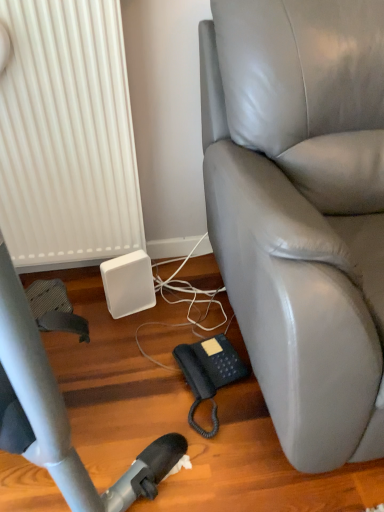
Question: Does black rubberized phone at lower center come in front of gray leather chair at right?

Choices:
 (A) yes
 (B) no

Answer: (B)

Question: From the image's perspective, is black rubberized phone at lower center beneath gray leather chair at right?

Choices:
 (A) yes
 (B) no

Answer: (A)

Question: From a real-world perspective, is black rubberized phone at lower center positioned under gray leather chair at right based on gravity?

Choices:
 (A) no
 (B) yes

Answer: (B)

Question: Can gray leather chair at right be found inside black rubberized phone at lower center?

Choices:
 (A) yes
 (B) no

Answer: (B)

Question: From a real-world perspective, is black rubberized phone at lower center on gray leather chair at right?

Choices:
 (A) yes
 (B) no

Answer: (B)

Question: Can you confirm if black rubberized phone at lower center is shorter than gray leather chair at right?

Choices:
 (A) yes
 (B) no

Answer: (A)

Question: Is white ribbed radiator at lower left turned away from gray leather chair at right?

Choices:
 (A) yes
 (B) no

Answer: (B)

Question: From a real-world perspective, is white ribbed radiator at lower left below gray leather chair at right?

Choices:
 (A) yes
 (B) no

Answer: (B)

Question: Does white ribbed radiator at lower left have a larger size compared to gray leather chair at right?

Choices:
 (A) yes
 (B) no

Answer: (B)

Question: From the image's perspective, is white ribbed radiator at lower left on gray leather chair at right?

Choices:
 (A) no
 (B) yes

Answer: (B)

Question: Can you confirm if white ribbed radiator at lower left is thinner than gray leather chair at right?

Choices:
 (A) yes
 (B) no

Answer: (A)

Question: Is white ribbed radiator at lower left touching gray leather chair at right?

Choices:
 (A) no
 (B) yes

Answer: (A)

Question: Is black rubberized phone at lower center far away from white matte speaker at lower left?

Choices:
 (A) no
 (B) yes

Answer: (A)